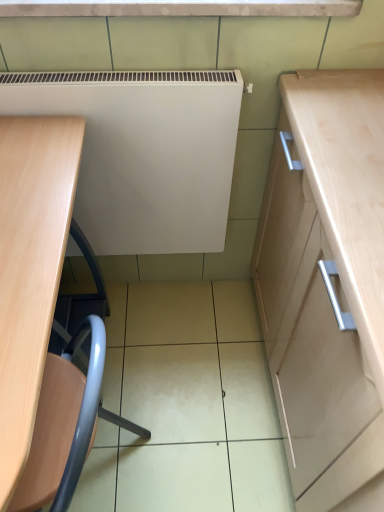
What do you see at coordinates (30, 268) in the screenshot? I see `light wood desk at left` at bounding box center [30, 268].

Where is `metallic blue swivel chair at lower left`? Image resolution: width=384 pixels, height=512 pixels. metallic blue swivel chair at lower left is located at coordinates (63, 424).

Measure the distance between metallic blue swivel chair at lower left and camera.

metallic blue swivel chair at lower left and camera are 25.04 inches apart.

This screenshot has width=384, height=512. What do you see at coordinates (144, 153) in the screenshot?
I see `white matte radiator at center` at bounding box center [144, 153].

Where is `light wood desk at left`? light wood desk at left is located at coordinates (30, 268).

What's the angular difference between white matte radiator at center and light wood desk at left's facing directions?

The angle between the facing direction of white matte radiator at center and the facing direction of light wood desk at left is 89.7 degrees.

From a real-world perspective, is white matte radiator at center positioned under light wood desk at left based on gravity?

No, from a real-world perspective, white matte radiator at center is not below light wood desk at left.

Can you confirm if white matte radiator at center is smaller than light wood desk at left?

Yes.

From the image's perspective, is white matte radiator at center located beneath light wood desk at left?

No, from the image's perspective, white matte radiator at center is not below light wood desk at left.

Is metallic blue swivel chair at lower left smaller than light wood desk at left?

Yes.

Would you say metallic blue swivel chair at lower left contains light wood desk at left?

No, light wood desk at left is located outside of metallic blue swivel chair at lower left.

Does metallic blue swivel chair at lower left have a lesser width compared to light wood desk at left?

Yes.

Is metallic blue swivel chair at lower left a part of white matte radiator at center?

Definitely not — metallic blue swivel chair at lower left is not inside white matte radiator at center.

Can you confirm if white matte radiator at center is taller than metallic blue swivel chair at lower left?

Incorrect, the height of white matte radiator at center is not larger of that of metallic blue swivel chair at lower left.

Is white matte radiator at center positioned with its back to metallic blue swivel chair at lower left?

No, white matte radiator at center is not facing the opposite direction of metallic blue swivel chair at lower left.

There is a metallic blue swivel chair at lower left. In order to click on appliance above it (from a real-world perspective) in this screenshot , I will do `click(144, 153)`.

Is light wood desk at left not within metallic blue swivel chair at lower left?

Yes, light wood desk at left is outside of metallic blue swivel chair at lower left.

From the image's perspective, between light wood desk at left and metallic blue swivel chair at lower left, who is located below?

From the image's view, metallic blue swivel chair at lower left is below.

Does light wood desk at left have a larger size compared to metallic blue swivel chair at lower left?

Yes.

From a real-world perspective, is light wood desk at left on metallic blue swivel chair at lower left?

Yes, from a real-world perspective, light wood desk at left is over metallic blue swivel chair at lower left

From the image's perspective, does metallic blue swivel chair at lower left appear lower than white matte radiator at center?

Yes, from the image's perspective, metallic blue swivel chair at lower left is beneath white matte radiator at center.

Would you consider metallic blue swivel chair at lower left to be distant from white matte radiator at center?

No, metallic blue swivel chair at lower left is in close proximity to white matte radiator at center.

Does metallic blue swivel chair at lower left lie behind white matte radiator at center?

That is False.

Locate an element on the screen. appliance located above the metallic blue swivel chair at lower left (from a real-world perspective) is located at coordinates (144, 153).

Does light wood desk at left have a larger size compared to white matte radiator at center?

Correct, light wood desk at left is larger in size than white matte radiator at center.

Consider the image. Is light wood desk at left not close to white matte radiator at center?

No, there isn't a large distance between light wood desk at left and white matte radiator at center.

Based on the photo, which object is thinner, light wood desk at left or white matte radiator at center?

white matte radiator at center.

Locate an element on the screen. This screenshot has height=512, width=384. desk located below the white matte radiator at center (from the image's perspective) is located at coordinates (30, 268).

Where is `desk that appears in front of the metallic blue swivel chair at lower left`? This screenshot has height=512, width=384. desk that appears in front of the metallic blue swivel chair at lower left is located at coordinates (30, 268).

Which object lies further to the anchor point white matte radiator at center, light wood desk at left or metallic blue swivel chair at lower left?

Among the two, metallic blue swivel chair at lower left is located further to white matte radiator at center.

Based on their spatial positions, is light wood desk at left or white matte radiator at center further from metallic blue swivel chair at lower left?

The object further to metallic blue swivel chair at lower left is white matte radiator at center.

Looking at the image, which one is located closer to metallic blue swivel chair at lower left, white matte radiator at center or light wood desk at left?

The object closer to metallic blue swivel chair at lower left is light wood desk at left.

Which object lies nearer to the anchor point light wood desk at left, white matte radiator at center or metallic blue swivel chair at lower left?

metallic blue swivel chair at lower left is closer to light wood desk at left.

Estimate the real-world distances between objects in this image. Which object is further from white matte radiator at center, metallic blue swivel chair at lower left or light wood desk at left?

metallic blue swivel chair at lower left lies further to white matte radiator at center than the other object.

From the image, which object appears to be farther from light wood desk at left, metallic blue swivel chair at lower left or white matte radiator at center?

white matte radiator at center.

Locate an element on the screen. The height and width of the screenshot is (512, 384). desk that lies between white matte radiator at center and metallic blue swivel chair at lower left from top to bottom is located at coordinates (30, 268).